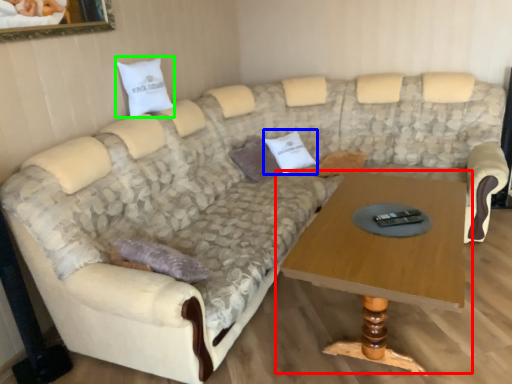
Question: Which is nearer to the coffee table (highlighted by a red box)? pillow (highlighted by a blue box) or pillow (highlighted by a green box).

Choices:
 (A) pillow
 (B) pillow

Answer: (A)